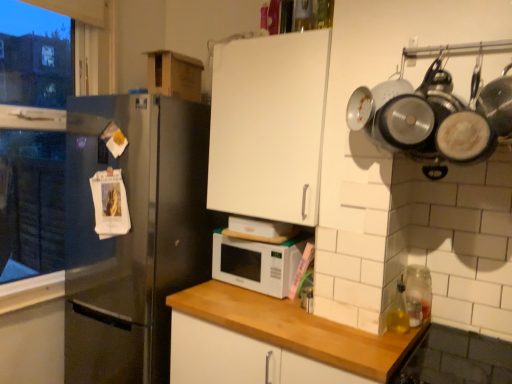
Question: In which direction should I rotate to look at white wood countertop at center, which appears as the first cabinetry when ordered from the bottom?

Choices:
 (A) left
 (B) right

Answer: (B)

Question: From a real-world perspective, is stainless steel refrigerator at left on top of clear glass jar at right?

Choices:
 (A) yes
 (B) no

Answer: (B)

Question: Considering the relative sizes of stainless steel refrigerator at left and clear glass jar at right in the image provided, is stainless steel refrigerator at left thinner than clear glass jar at right?

Choices:
 (A) yes
 (B) no

Answer: (B)

Question: Is stainless steel refrigerator at left not close to clear glass jar at right?

Choices:
 (A) no
 (B) yes

Answer: (B)

Question: Can you confirm if stainless steel refrigerator at left is bigger than clear glass jar at right?

Choices:
 (A) yes
 (B) no

Answer: (A)

Question: Does stainless steel refrigerator at left have a lesser height compared to clear glass jar at right?

Choices:
 (A) no
 (B) yes

Answer: (A)

Question: Is stainless steel refrigerator at left smaller than clear glass jar at right?

Choices:
 (A) no
 (B) yes

Answer: (A)

Question: Considering the relative sizes of clear glass jar at right and white matte microwave at center in the image provided, is clear glass jar at right taller than white matte microwave at center?

Choices:
 (A) no
 (B) yes

Answer: (A)

Question: Is clear glass jar at right oriented away from white matte microwave at center?

Choices:
 (A) no
 (B) yes

Answer: (B)

Question: Is clear glass jar at right facing towards white matte microwave at center?

Choices:
 (A) yes
 (B) no

Answer: (B)

Question: Can you confirm if clear glass jar at right is smaller than white matte microwave at center?

Choices:
 (A) no
 (B) yes

Answer: (B)

Question: Considering the relative positions of clear glass jar at right and white matte microwave at center in the image provided, is clear glass jar at right to the right of white matte microwave at center from the viewer's perspective?

Choices:
 (A) yes
 (B) no

Answer: (A)

Question: From the image's perspective, would you say clear glass jar at right is shown under white matte microwave at center?

Choices:
 (A) yes
 (B) no

Answer: (A)

Question: Is white matte microwave at center positioned beyond the bounds of clear glass jar at right?

Choices:
 (A) yes
 (B) no

Answer: (A)